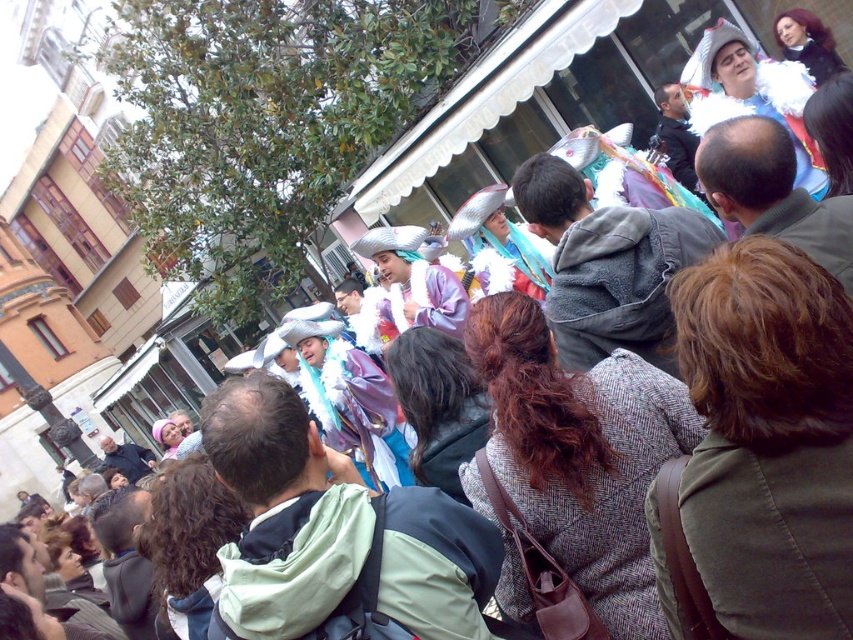
Question: Can you confirm if shiny silver hat at center is bigger than dark brown hair at center?

Choices:
 (A) no
 (B) yes

Answer: (B)

Question: Which is farther from the dark brown hair at center?

Choices:
 (A) light brown hair at center
 (B) shiny silver hat at center
 (C) white fluffy hat at upper right
 (D) dark brown curly hair at center

Answer: (A)

Question: Which point is farther to the camera?

Choices:
 (A) shiny silver hat at center
 (B) white fluffy hat at upper right

Answer: (A)

Question: Is brown wool coat at center behind light brown hair at center?

Choices:
 (A) yes
 (B) no

Answer: (B)

Question: Can you confirm if dark brown curly hair at center is positioned below dark brown hair at center?

Choices:
 (A) yes
 (B) no

Answer: (A)

Question: Based on their relative distances, which object is nearer to the shiny silver hat at center?

Choices:
 (A) white fluffy hat at upper right
 (B) brown wool coat at center
 (C) shiny black hair at upper right
 (D) light brown hair at center

Answer: (B)